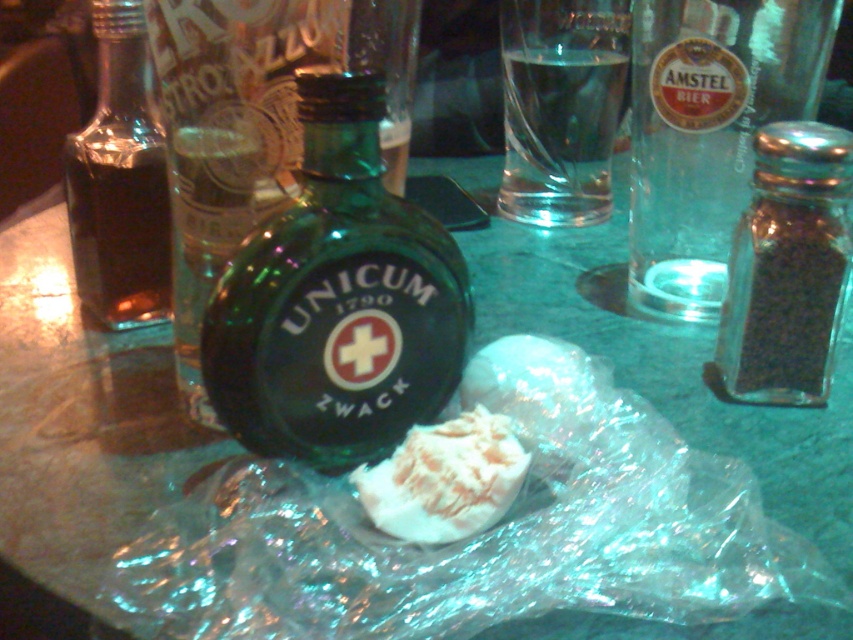
Question: Which object is positioned closest to the dark brown glass bottle at left?

Choices:
 (A) clear glass bottle at right
 (B) transparent glass pepper shaker at center-right

Answer: (A)

Question: Which object appears closest to the camera in this image?

Choices:
 (A) clear glass bottle at right
 (B) dark brown glass bottle at left
 (C) green glass bottle at center

Answer: (C)

Question: Can you confirm if dark brown glass bottle at left is positioned to the left of white crumbly cheese at center?

Choices:
 (A) yes
 (B) no

Answer: (A)

Question: Does green glass bottle at center have a greater width compared to clear glass bottle at right?

Choices:
 (A) yes
 (B) no

Answer: (B)

Question: Can you confirm if clear glass bottle at right is smaller than transparent glass pepper shaker at center-right?

Choices:
 (A) yes
 (B) no

Answer: (B)

Question: Which object is positioned closest to the dark brown glass bottle at left?

Choices:
 (A) green glass bottle at center
 (B) clear glass water at upper center
 (C) white crumbly cheese at center
 (D) transparent glass pepper shaker at center-right

Answer: (A)